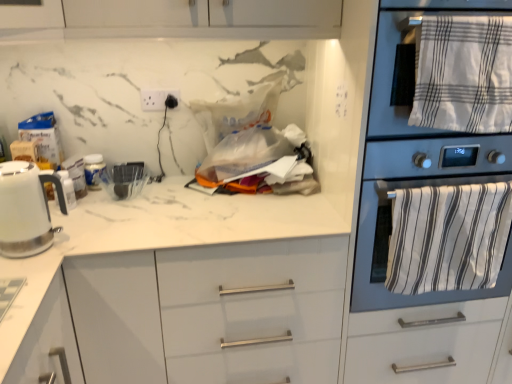
Question: Is white striped towel at upper right, placed as the 2th bath towel when sorted from bottom to top, a part of white marble countertop at center?

Choices:
 (A) no
 (B) yes

Answer: (A)

Question: From a real-world perspective, is white marble countertop at center beneath white striped towel at upper right, the 1th bath towel viewed from the top?

Choices:
 (A) no
 (B) yes

Answer: (B)

Question: Considering the relative sizes of white marble countertop at center and white striped towel at upper right, the 1th bath towel viewed from the top, in the image provided, is white marble countertop at center smaller than white striped towel at upper right, the 1th bath towel viewed from the top,?

Choices:
 (A) no
 (B) yes

Answer: (A)

Question: Is white marble countertop at center far from white striped towel at upper right, placed as the 2th bath towel when sorted from bottom to top?

Choices:
 (A) no
 (B) yes

Answer: (A)

Question: Is white marble countertop at center thinner than white striped towel at upper right, placed as the 2th bath towel when sorted from bottom to top?

Choices:
 (A) yes
 (B) no

Answer: (B)

Question: Based on their positions, is white striped towel at upper right, placed as the 2th bath towel when sorted from bottom to top, located to the left or right of white marble countertop at center?

Choices:
 (A) left
 (B) right

Answer: (B)

Question: Considering their positions, is white striped towel at upper right, placed as the 2th bath towel when sorted from bottom to top, located in front of or behind white marble countertop at center?

Choices:
 (A) front
 (B) behind

Answer: (A)

Question: Which is correct: white striped towel at upper right, the 1th bath towel viewed from the top, is inside white marble countertop at center, or outside of it?

Choices:
 (A) outside
 (B) inside

Answer: (A)

Question: Is white striped towel at upper right, placed as the 2th bath towel when sorted from bottom to top, taller or shorter than white marble countertop at center?

Choices:
 (A) tall
 (B) short

Answer: (B)

Question: From the image's perspective, is white striped towel at upper right, placed as the 2th bath towel when sorted from bottom to top, above or below white glossy electric kettle at left?

Choices:
 (A) below
 (B) above

Answer: (B)

Question: Is white striped towel at upper right, placed as the 2th bath towel when sorted from bottom to top, to the left or to the right of white glossy electric kettle at left in the image?

Choices:
 (A) left
 (B) right

Answer: (B)

Question: In terms of height, does white striped towel at upper right, placed as the 2th bath towel when sorted from bottom to top, look taller or shorter compared to white glossy electric kettle at left?

Choices:
 (A) tall
 (B) short

Answer: (A)

Question: In the image, is white striped towel at upper right, the 1th bath towel viewed from the top, positioned in front of or behind white glossy electric kettle at left?

Choices:
 (A) front
 (B) behind

Answer: (B)

Question: From the image's perspective, is white glossy electric kettle at left above or below white striped towel at upper right, the 1th bath towel viewed from the top?

Choices:
 (A) below
 (B) above

Answer: (A)

Question: From a real-world perspective, is white glossy electric kettle at left positioned above or below white striped towel at upper right, placed as the 2th bath towel when sorted from bottom to top?

Choices:
 (A) above
 (B) below

Answer: (B)